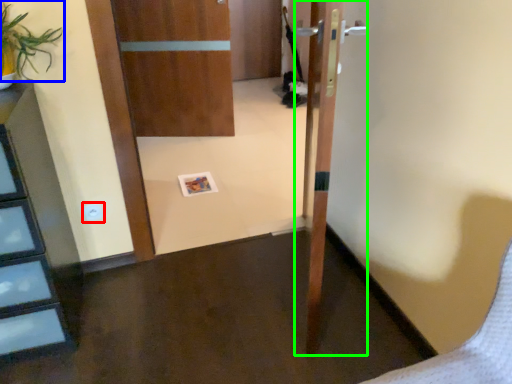
Question: Based on their relative distances, which object is farther from electric outlet (highlighted by a red box)? Choose from plant (highlighted by a blue box) and door (highlighted by a green box).

Choices:
 (A) plant
 (B) door

Answer: (B)